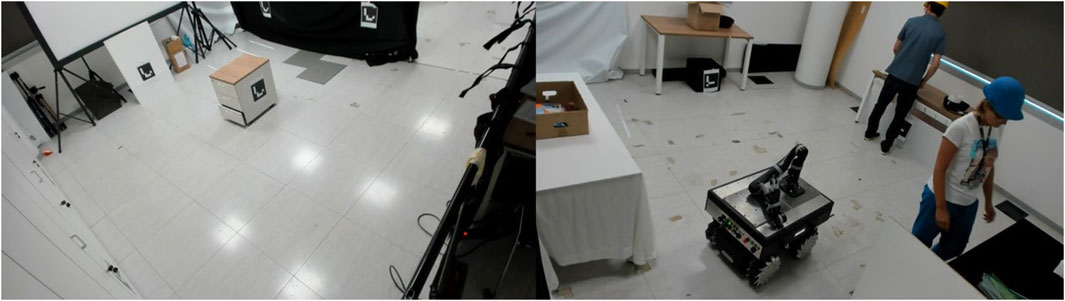
Where is `tile floor`? This screenshot has height=301, width=1065. tile floor is located at coordinates (321, 150).